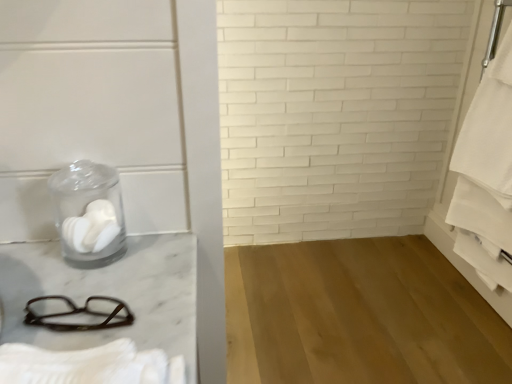
Question: From the image's perspective, is white cotton bath towel at lower left, positioned as the first bath towel in left-to-right order, positioned above or below transparent glass jar at left?

Choices:
 (A) above
 (B) below

Answer: (B)

Question: Is white cotton bath towel at lower left, positioned as the first bath towel in left-to-right order, wider or thinner than transparent glass jar at left?

Choices:
 (A) thin
 (B) wide

Answer: (B)

Question: Which object is positioned closest to the white cotton bath towel at right, positioned as the 2th bath towel in front-to-back order?

Choices:
 (A) brown plastic glasses at lower left
 (B) transparent glass jar at left
 (C) white matte toilet paper at left
 (D) white cotton bath towel at lower left, marked as the 1th bath towel in a bottom-to-top arrangement

Answer: (B)

Question: Which is nearer to the transparent glass jar at left?

Choices:
 (A) brown plastic glasses at lower left
 (B) white cotton bath towel at lower left, marked as the 1th bath towel in a bottom-to-top arrangement
 (C) white cotton bath towel at right, the 1th bath towel in the right-to-left sequence
 (D) white matte toilet paper at left

Answer: (D)